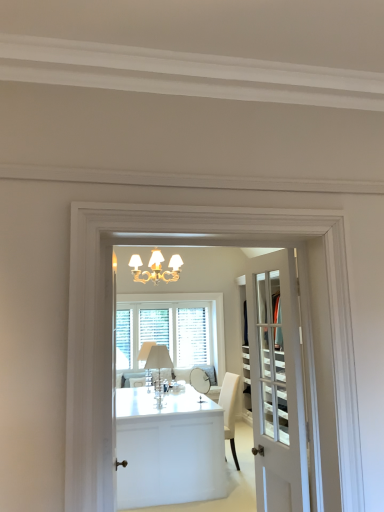
Question: In terms of size, does white glossy cabinet at center appear bigger or smaller than white wood window at center?

Choices:
 (A) big
 (B) small

Answer: (A)

Question: From their relative heights in the image, would you say white glossy cabinet at center is taller or shorter than white wood window at center?

Choices:
 (A) tall
 (B) short

Answer: (B)

Question: Which object is positioned closest to the white glass lampshade at center?

Choices:
 (A) white glass door at center
 (B) white wood window at center
 (C) white glossy cabinet at center

Answer: (C)

Question: Which is farther from the white wood window at center?

Choices:
 (A) white glass door at center
 (B) white glass lampshade at center
 (C) white glossy cabinet at center

Answer: (A)